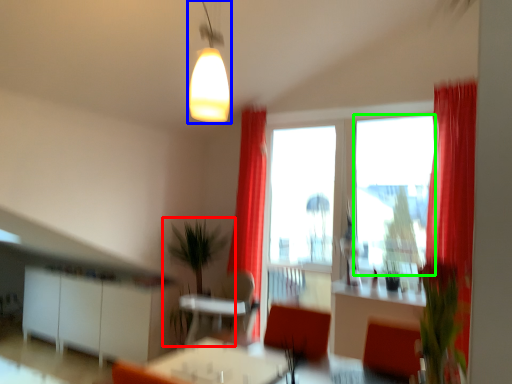
Question: Which is nearer to the houseplant (highlighted by a red box)? light fixture (highlighted by a blue box) or window screen (highlighted by a green box).

Choices:
 (A) light fixture
 (B) window screen

Answer: (B)